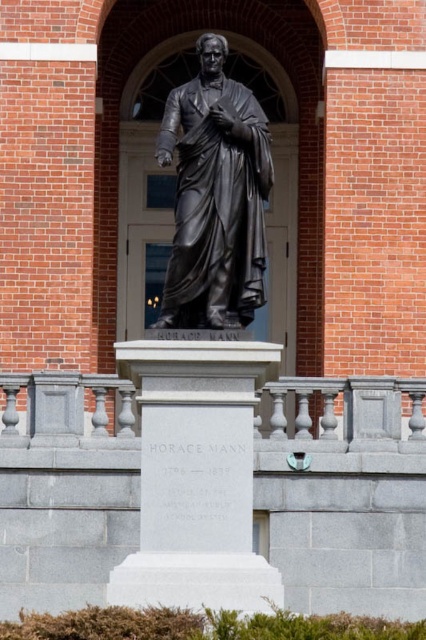
Question: Does white marble pedestal at center appear over black polished statue at center?

Choices:
 (A) no
 (B) yes

Answer: (A)

Question: Which point appears closest to the camera in this image?

Choices:
 (A) (258, 228)
 (B) (252, 424)

Answer: (B)

Question: Does white marble pedestal at center have a larger size compared to black polished statue at center?

Choices:
 (A) yes
 (B) no

Answer: (B)

Question: Does white marble pedestal at center come in front of black polished statue at center?

Choices:
 (A) yes
 (B) no

Answer: (A)